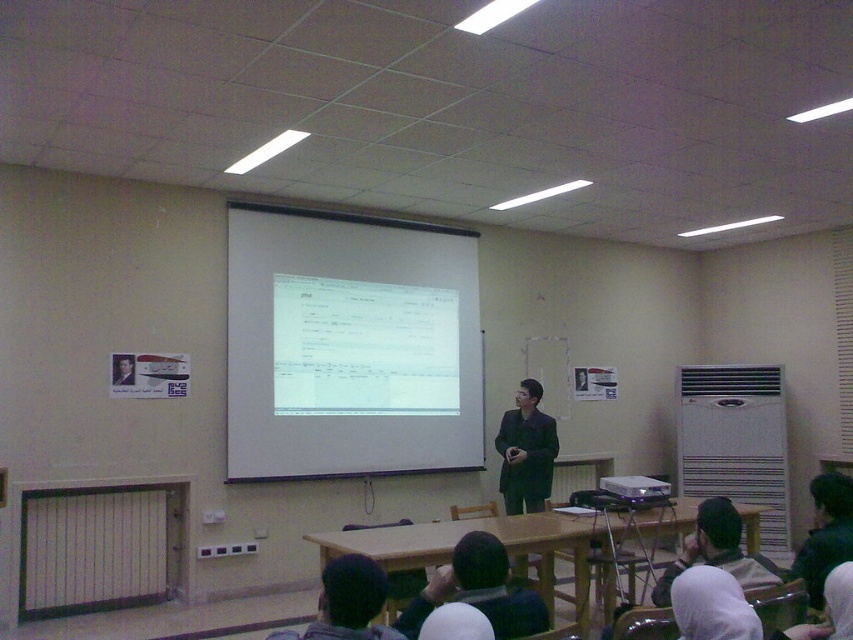
The height and width of the screenshot is (640, 853). I want to click on dark matte suit at center, so click(x=526, y=451).

Which is behind, point (544, 448) or point (607, 492)?

The point (544, 448) is more distant.

This screenshot has width=853, height=640. Find the location of `dark matte suit at center`. dark matte suit at center is located at coordinates (526, 451).

How far apart are white matte projection screen at center and dark matte suit at center?

The distance of white matte projection screen at center from dark matte suit at center is 3.95 feet.

Which is above, white matte projection screen at center or dark matte suit at center?

white matte projection screen at center

Is point (467, 433) farther from viewer compared to point (538, 436)?

Yes, point (467, 433) is farther from viewer.

The height and width of the screenshot is (640, 853). What are the coordinates of `white matte projection screen at center` in the screenshot? It's located at (349, 346).

Is white matte projection screen at center to the right of matte black projector at center from the viewer's perspective?

Incorrect, white matte projection screen at center is not on the right side of matte black projector at center.

Is white matte projection screen at center thinner than matte black projector at center?

In fact, white matte projection screen at center might be wider than matte black projector at center.

Is point (477, 285) positioned behind point (654, 497)?

That is True.

You are a GUI agent. You are given a task and a screenshot of the screen. Output one action in this format:
    pyautogui.click(x=<x>, y=<y>)
    Task: Click on the white matte projection screen at center
    This screenshot has height=640, width=853.
    Given the screenshot: What is the action you would take?
    pyautogui.click(x=349, y=346)